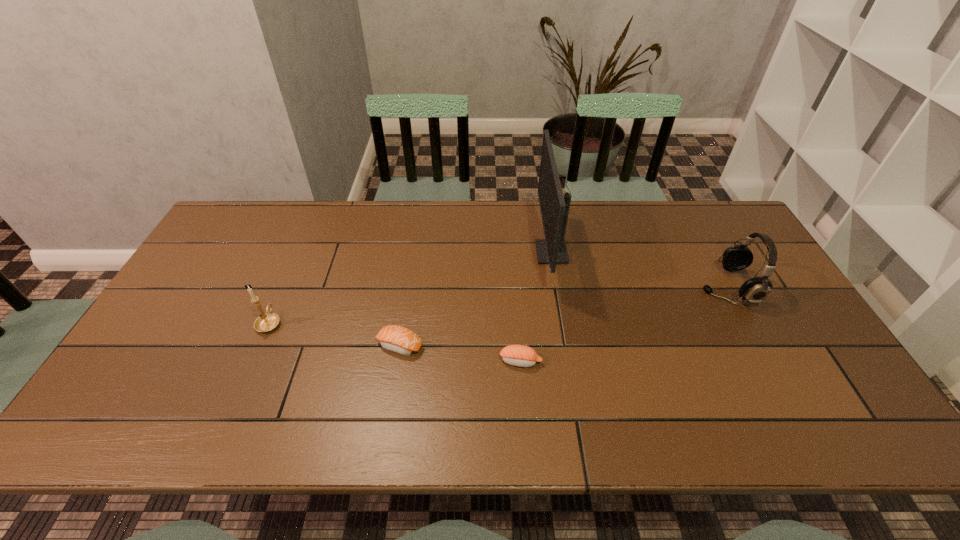
You are a GUI agent. You are given a task and a screenshot of the screen. Output one action in this format:
    pyautogui.click(x=<x>, y=<y>)
    Task: Click on the vacant space located 0.290m on the front-facing side of the second object from right to left
    
    Given the screenshot: What is the action you would take?
    pyautogui.click(x=444, y=253)

Locate an element on the screen. This screenshot has height=540, width=960. free location located with the microphone on the side of the headset is located at coordinates (660, 287).

You are a GUI agent. You are given a task and a screenshot of the screen. Output one action in this format:
    pyautogui.click(x=<x>, y=<y>)
    Task: Click on the vacant space positioned with the microphone on the side of the headset
    
    Given the screenshot: What is the action you would take?
    pyautogui.click(x=601, y=287)

The height and width of the screenshot is (540, 960). What are the coordinates of `free space located 0.330m with the microphone on the side of the headset` in the screenshot? It's located at (588, 287).

Where is `vacant space positioned 0.180m on the handle side of the third shortest object`? The width and height of the screenshot is (960, 540). vacant space positioned 0.180m on the handle side of the third shortest object is located at coordinates (294, 266).

The image size is (960, 540). Find the location of `vacant point located 0.350m on the handle side of the third shortest object`. vacant point located 0.350m on the handle side of the third shortest object is located at coordinates (309, 231).

Locate an element on the screen. vacant space located 0.340m on the handle side of the third shortest object is located at coordinates (308, 233).

You are a GUI agent. You are given a task and a screenshot of the screen. Output one action in this format:
    pyautogui.click(x=<x>, y=<y>)
    Task: Click on the vacant space located 0.200m on the back of the third object from left to right
    
    Given the screenshot: What is the action you would take?
    tap(516, 295)

Identify the location of vacant area located 0.320m on the back of the second object from left to right. The width and height of the screenshot is (960, 540). (415, 253).

Locate an element on the screen. object located at the far edge is located at coordinates (554, 207).